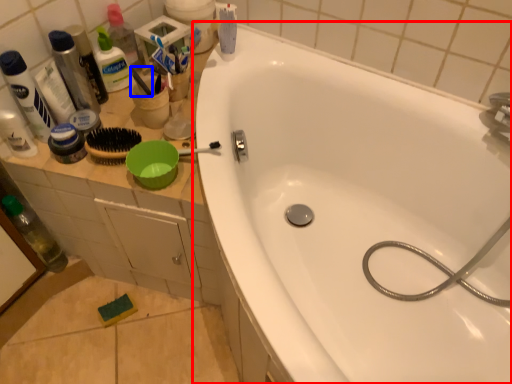
Question: Which object appears closest to the camera in this image, bathtub (highlighted by a red box) or brush (highlighted by a blue box)?

Choices:
 (A) bathtub
 (B) brush

Answer: (A)